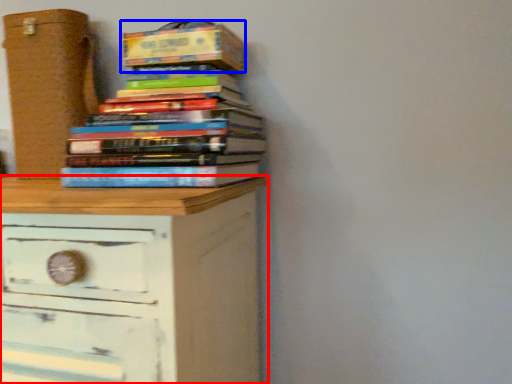
Question: Which of the following is the farthest to the observer, chest of drawers (highlighted by a red box) or paperback book (highlighted by a blue box)?

Choices:
 (A) chest of drawers
 (B) paperback book

Answer: (B)